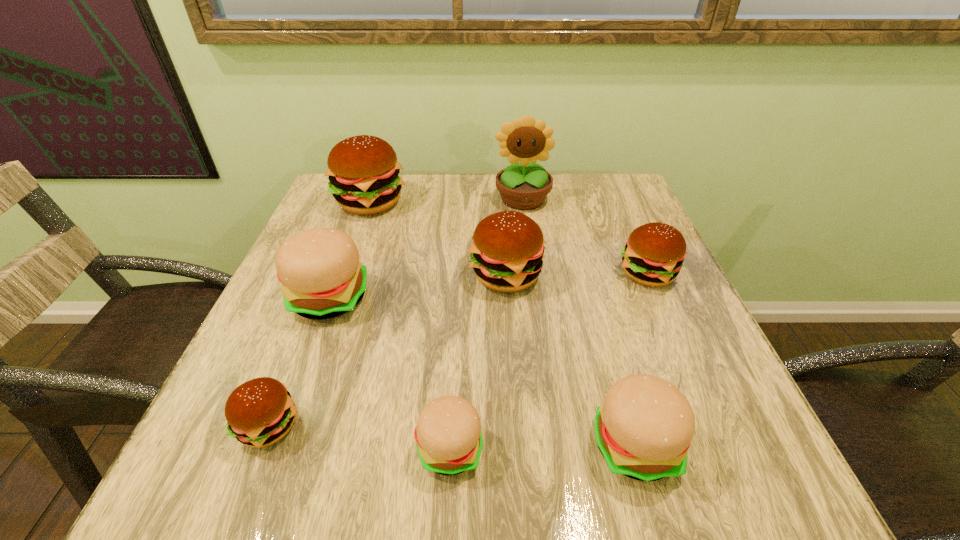
This screenshot has height=540, width=960. Find the location of `sunflower`. sunflower is located at coordinates coord(522,186).

This screenshot has width=960, height=540. Find the location of `the tallest object`. the tallest object is located at coordinates (522, 186).

Image resolution: width=960 pixels, height=540 pixels. What are the coordinates of `the farthest brown hamburger` in the screenshot? It's located at (363, 170).

Locate an element on the screen. The height and width of the screenshot is (540, 960). the farthest hamburger is located at coordinates (363, 170).

Identify the location of the third brown hamburger from left to right. The height and width of the screenshot is (540, 960). (506, 254).

This screenshot has height=540, width=960. In order to click on the biggest beige hamburger in this screenshot , I will do `click(322, 278)`.

Identify the location of the farthest beige hamburger. This screenshot has width=960, height=540. (322, 278).

Find the location of a particular element. The height and width of the screenshot is (540, 960). the rightmost brown hamburger is located at coordinates (653, 256).

Identify the location of the rightmost hamburger. This screenshot has height=540, width=960. (653, 256).

In order to click on the second hamburger from right to left in this screenshot , I will do `click(643, 429)`.